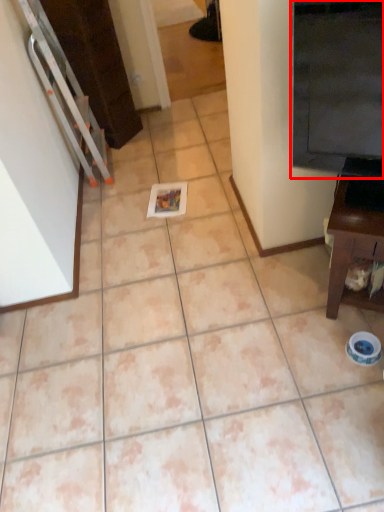
Question: In this image, where is fridge (annotated by the red box) located relative to furniture?

Choices:
 (A) left
 (B) right

Answer: (A)